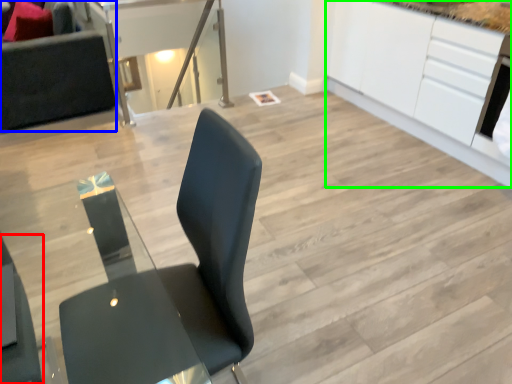
Question: Estimate the real-world distances between objects in this image. Which object is closer to chair (highlighted by a red box), couch (highlighted by a blue box) or cabinetry (highlighted by a green box)?

Choices:
 (A) couch
 (B) cabinetry

Answer: (A)